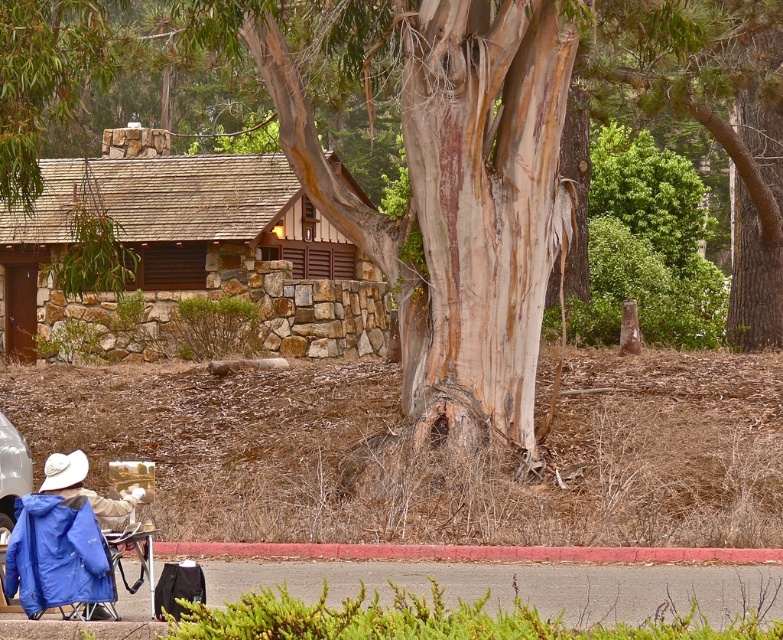
Consider the image. You are an architect designing a new outdoor space. You want to place a small garden between the stone cabin at center and the white matte cowboy hat at lower left. Which object should the garden be closer to to ensure it doesn

The garden should be closer to the white matte cowboy hat at lower left because the stone cabin at center is bigger and might require more space around it.

You are a hiker who just arrived at the stone house and see the blue fabric jacket at lower left and the white matte cowboy hat at lower left. Which item is closer to the ground?

The blue fabric jacket at lower left is positioned under the white matte cowboy hat at lower left, so it is closer to the ground.